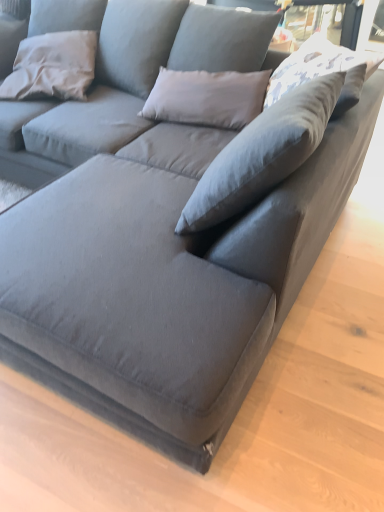
Find the location of a particular element. gray fabric pillow at upper left, which appears as the 2th pillow when viewed from the front is located at coordinates tap(53, 66).

What is the approximate height of gray fabric pillow at upper left, the first pillow from the back?

The height of gray fabric pillow at upper left, the first pillow from the back, is 8.96 inches.

What do you see at coordinates (53, 66) in the screenshot?
I see `gray fabric pillow at upper left, which is the second pillow in right-to-left order` at bounding box center [53, 66].

Locate an element on the screen. The height and width of the screenshot is (512, 384). white printed fabric pillow at upper right, the second pillow viewed from the left is located at coordinates (319, 76).

The height and width of the screenshot is (512, 384). Describe the element at coordinates (319, 76) in the screenshot. I see `white printed fabric pillow at upper right, the second pillow when ordered from back to front` at that location.

At what (x,y) coordinates should I click in order to perform the action: click on gray fabric pillow at upper left, which appears as the 2th pillow when viewed from the front. Please return your answer as a coordinate pair (x, y). Looking at the image, I should click on (53, 66).

Based on their positions, is white printed fabric pillow at upper right, which is the first pillow in front-to-back order, located to the left or right of gray fabric pillow at upper left, which appears as the 2th pillow when viewed from the front?

In the image, white printed fabric pillow at upper right, which is the first pillow in front-to-back order, appears on the right side of gray fabric pillow at upper left, which appears as the 2th pillow when viewed from the front.

Is white printed fabric pillow at upper right, the second pillow when ordered from back to front, behind gray fabric pillow at upper left, which appears as the 2th pillow when viewed from the front?

No.

Which point is more distant from viewer, (273, 78) or (52, 59)?

The point (52, 59) is farther from the camera.

From the image's perspective, who appears lower, white printed fabric pillow at upper right, the second pillow viewed from the left, or gray fabric pillow at upper left, which is the second pillow in right-to-left order?

white printed fabric pillow at upper right, the second pillow viewed from the left.

From a real-world perspective, is white printed fabric pillow at upper right, the second pillow viewed from the left, positioned above or below gray fabric pillow at upper left, which is the second pillow in right-to-left order?

From a real-world perspective, white printed fabric pillow at upper right, the second pillow viewed from the left, is physically above gray fabric pillow at upper left, which is the second pillow in right-to-left order.

Between white printed fabric pillow at upper right, which is the first pillow in right-to-left order, and gray fabric pillow at upper left, placed as the first pillow when sorted from left to right, which one has larger width?

white printed fabric pillow at upper right, which is the first pillow in right-to-left order, is wider.

Between white printed fabric pillow at upper right, the second pillow when ordered from back to front, and gray fabric pillow at upper left, the first pillow from the back, which one has less height?

white printed fabric pillow at upper right, the second pillow when ordered from back to front.

Considering the relative sizes of white printed fabric pillow at upper right, the second pillow when ordered from back to front, and gray fabric pillow at upper left, which appears as the 2th pillow when viewed from the front, in the image provided, is white printed fabric pillow at upper right, the second pillow when ordered from back to front, bigger than gray fabric pillow at upper left, which appears as the 2th pillow when viewed from the front,?

Incorrect, white printed fabric pillow at upper right, the second pillow when ordered from back to front, is not larger than gray fabric pillow at upper left, which appears as the 2th pillow when viewed from the front.

Is white printed fabric pillow at upper right, which is the first pillow in front-to-back order, inside or outside of gray fabric pillow at upper left, the first pillow from the back?

white printed fabric pillow at upper right, which is the first pillow in front-to-back order, exists outside the volume of gray fabric pillow at upper left, the first pillow from the back.

Would you say white printed fabric pillow at upper right, which is the first pillow in front-to-back order, is a long distance from gray fabric pillow at upper left, which is the second pillow in right-to-left order?

Yes, white printed fabric pillow at upper right, which is the first pillow in front-to-back order, is far from gray fabric pillow at upper left, which is the second pillow in right-to-left order.

Could you tell me if white printed fabric pillow at upper right, the second pillow when ordered from back to front, is turned towards gray fabric pillow at upper left, the first pillow from the back?

No.

How many degrees apart are the facing directions of white printed fabric pillow at upper right, which is the first pillow in front-to-back order, and gray fabric pillow at upper left, placed as the first pillow when sorted from left to right?

The angle between the facing direction of white printed fabric pillow at upper right, which is the first pillow in front-to-back order, and the facing direction of gray fabric pillow at upper left, placed as the first pillow when sorted from left to right, is 20.7 degrees.

Where is `pillow below the white printed fabric pillow at upper right, which is the first pillow in front-to-back order (from a real-world perspective)`? The height and width of the screenshot is (512, 384). pillow below the white printed fabric pillow at upper right, which is the first pillow in front-to-back order (from a real-world perspective) is located at coordinates (53, 66).

Between gray fabric pillow at upper left, which appears as the 2th pillow when viewed from the front, and white printed fabric pillow at upper right, which is the first pillow in front-to-back order, which one appears on the right side from the viewer's perspective?

Positioned to the right is white printed fabric pillow at upper right, which is the first pillow in front-to-back order.

Which is in front, gray fabric pillow at upper left, placed as the first pillow when sorted from left to right, or white printed fabric pillow at upper right, which is the first pillow in front-to-back order?

white printed fabric pillow at upper right, which is the first pillow in front-to-back order, is more forward.

Considering the points (80, 53) and (319, 58), which point is in front, point (80, 53) or point (319, 58)?

The point (319, 58) is more forward.

From the image's perspective, would you say gray fabric pillow at upper left, which is the second pillow in right-to-left order, is shown under white printed fabric pillow at upper right, which is the first pillow in right-to-left order?

No, from the image's perspective, gray fabric pillow at upper left, which is the second pillow in right-to-left order, is not below white printed fabric pillow at upper right, which is the first pillow in right-to-left order.

From a real-world perspective, which is physically below, gray fabric pillow at upper left, which is the second pillow in right-to-left order, or white printed fabric pillow at upper right, which is the first pillow in right-to-left order?

gray fabric pillow at upper left, which is the second pillow in right-to-left order, from a real-world perspective.

Between gray fabric pillow at upper left, placed as the first pillow when sorted from left to right, and white printed fabric pillow at upper right, which is the first pillow in right-to-left order, which one has larger width?

white printed fabric pillow at upper right, which is the first pillow in right-to-left order.

Which of these two, gray fabric pillow at upper left, placed as the first pillow when sorted from left to right, or white printed fabric pillow at upper right, the second pillow when ordered from back to front, stands shorter?

Standing shorter between the two is white printed fabric pillow at upper right, the second pillow when ordered from back to front.

From the picture: Can you confirm if gray fabric pillow at upper left, which appears as the 2th pillow when viewed from the front, is bigger than white printed fabric pillow at upper right, which is the first pillow in front-to-back order?

Yes.

Is gray fabric pillow at upper left, which is the second pillow in right-to-left order, situated inside white printed fabric pillow at upper right, the second pillow when ordered from back to front, or outside?

gray fabric pillow at upper left, which is the second pillow in right-to-left order, is located beyond the bounds of white printed fabric pillow at upper right, the second pillow when ordered from back to front.

Based on the photo, is gray fabric pillow at upper left, placed as the first pillow when sorted from left to right, positioned far away from white printed fabric pillow at upper right, the second pillow when ordered from back to front?

Yes.

Is gray fabric pillow at upper left, placed as the first pillow when sorted from left to right, looking in the opposite direction of white printed fabric pillow at upper right, the second pillow when ordered from back to front?

gray fabric pillow at upper left, placed as the first pillow when sorted from left to right, does not have its back to white printed fabric pillow at upper right, the second pillow when ordered from back to front.

This screenshot has width=384, height=512. In the image, there is a gray fabric pillow at upper left, which appears as the 2th pillow when viewed from the front. What are the coordinates of `pillow below it (from the image's perspective)` in the screenshot? It's located at (319, 76).

I want to click on pillow above the gray fabric pillow at upper left, the first pillow from the back (from a real-world perspective), so click(x=319, y=76).

The width and height of the screenshot is (384, 512). Identify the location of pillow behind the white printed fabric pillow at upper right, the second pillow when ordered from back to front. (53, 66).